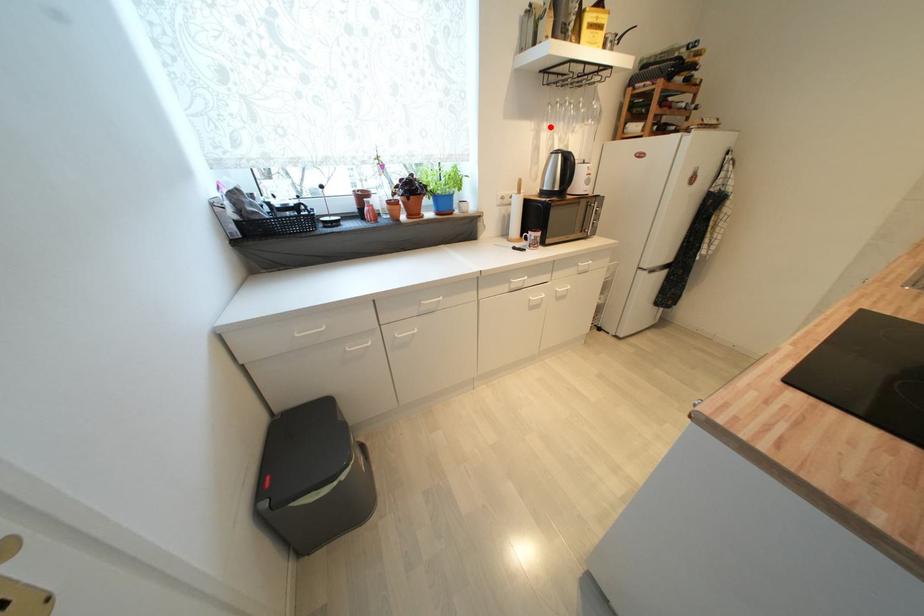
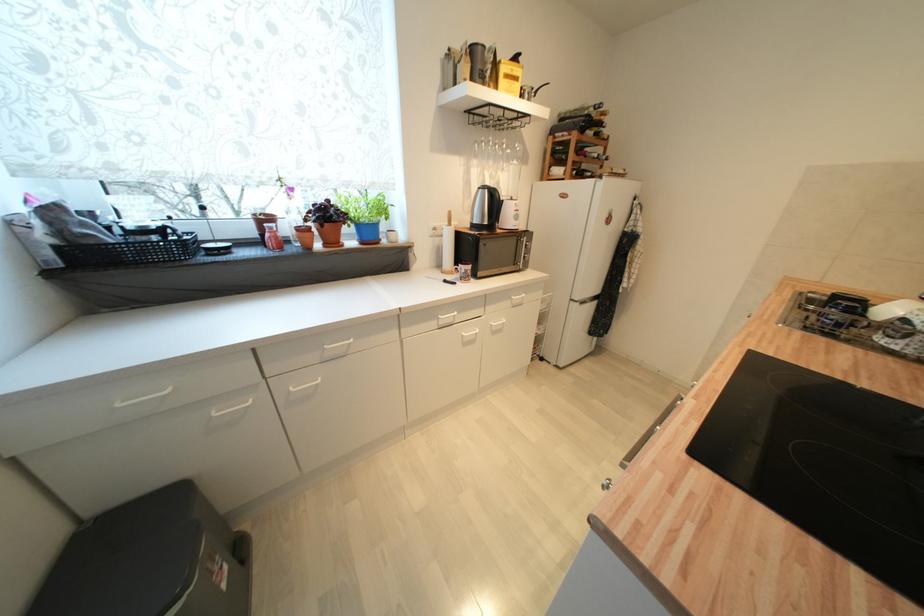
The point at the highlighted location is marked in the first image. Where is the corresponding point in the second image?

(480, 164)